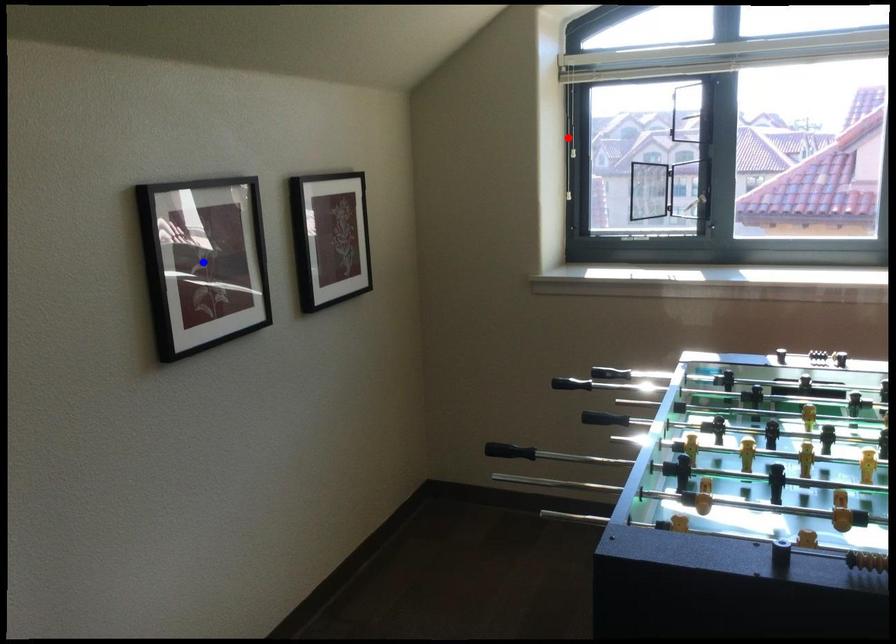
Question: Which of the two points in the image is closer to the camera?

Choices:
 (A) Blue point is closer.
 (B) Red point is closer.

Answer: (A)